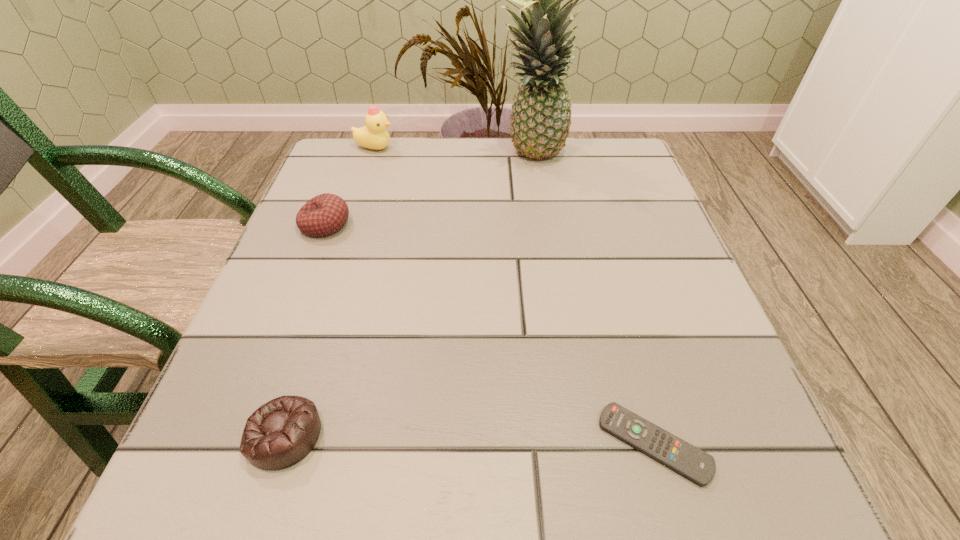
The height and width of the screenshot is (540, 960). Find the location of `object at the near right corner`. object at the near right corner is located at coordinates (699, 467).

Locate an element on the screen. The width and height of the screenshot is (960, 540). free location at the far edge of the desktop is located at coordinates (572, 191).

Find the location of a particular element. Image resolution: width=960 pixels, height=540 pixels. free region at the near edge is located at coordinates (561, 511).

Find the location of a particular element. Image resolution: width=960 pixels, height=540 pixels. vacant space at the left edge is located at coordinates (320, 281).

This screenshot has width=960, height=540. I want to click on free space at the right edge of the desktop, so click(x=658, y=213).

In the image, there is a desktop. Identify the location of vacant area at the far left corner. Image resolution: width=960 pixels, height=540 pixels. (388, 146).

Find the location of a particular element. This screenshot has height=540, width=960. free region at the far right corner of the desktop is located at coordinates (580, 138).

Where is `free point at the near right corner`? free point at the near right corner is located at coordinates (771, 457).

The width and height of the screenshot is (960, 540). What are the coordinates of `free point between the third nearest object and the pineapple` in the screenshot? It's located at (428, 190).

Locate an element on the screen. The width and height of the screenshot is (960, 540). vacant space that's between the third nearest object and the fourth tallest object is located at coordinates (305, 329).